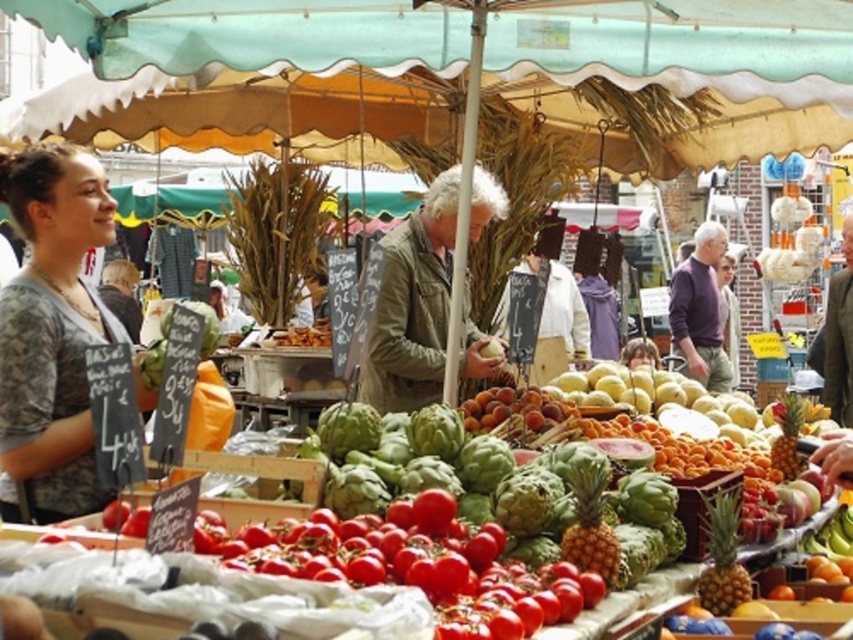
You are a customer at the market and want to buy a jacket. You see both the camouflage shirt at center and the khaki textured jacket at center. Which one is more visible to you?

The camouflage shirt at center is more visible because it is in front of the khaki textured jacket at center.